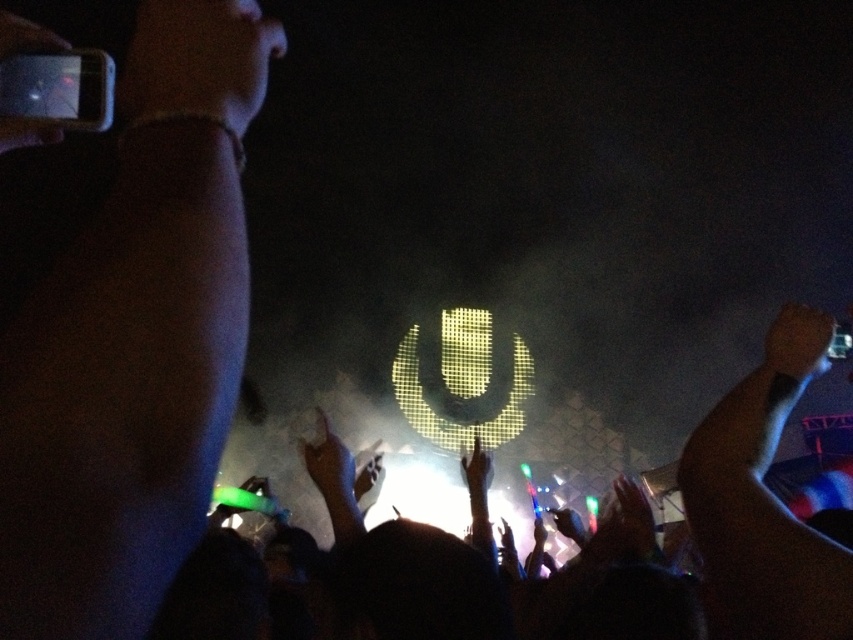
Does matte black hand at upper right appear on the left side of black matte phone at upper left?

Incorrect, matte black hand at upper right is not on the left side of black matte phone at upper left.

Is point (769, 340) positioned behind point (21, 132)?

Yes, point (769, 340) is farther from viewer.

Which is behind, point (790, 360) or point (1, 122)?

The point (790, 360) is more distant.

I want to click on matte black hand at upper right, so click(798, 342).